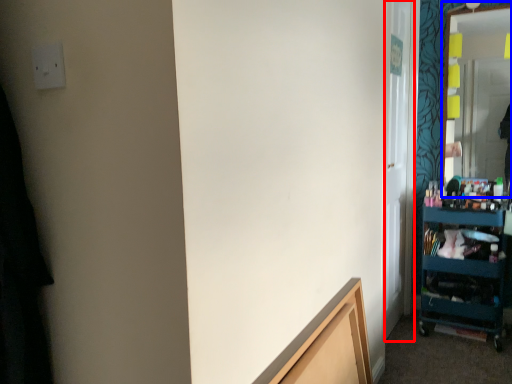
Question: Which of the following is the farthest to the observer, glass door (highlighted by a red box) or mirror (highlighted by a blue box)?

Choices:
 (A) glass door
 (B) mirror

Answer: (B)